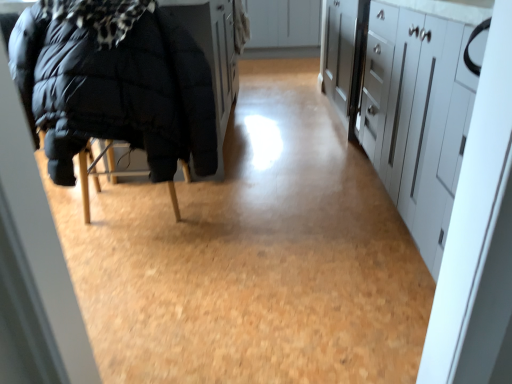
Question: From their relative heights in the image, would you say white glossy cabinets at right, arranged as the 2th cabinetry when viewed from the top, is taller or shorter than black puffy jacket at left?

Choices:
 (A) short
 (B) tall

Answer: (B)

Question: Would you say white glossy cabinets at right, arranged as the 2th cabinetry when viewed from the top, is inside or outside black puffy jacket at left?

Choices:
 (A) outside
 (B) inside

Answer: (A)

Question: Which object is the farthest from the white glossy cabinets at right, the first cabinetry from the front?

Choices:
 (A) black puffy jacket at left
 (B) white matte cabinet at upper center, the second cabinetry when ordered from front to back

Answer: (B)

Question: Which object is positioned closest to the white matte cabinet at upper center, which is counted as the second cabinetry, starting from the bottom?

Choices:
 (A) black puffy jacket at left
 (B) white glossy cabinets at right, the first cabinetry from the front

Answer: (B)